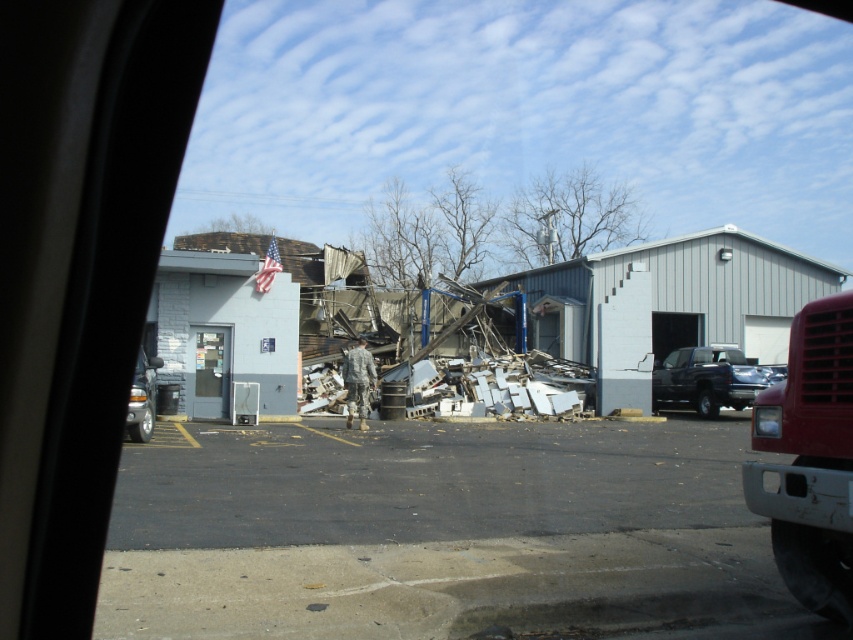
Question: Does matte black truck at right appear over clear glass vending machine at center?

Choices:
 (A) yes
 (B) no

Answer: (B)

Question: Does gray asphalt parking lot at center have a lesser width compared to matte black truck at right?

Choices:
 (A) no
 (B) yes

Answer: (A)

Question: Which of the following is the closest to the observer?

Choices:
 (A) (202, 378)
 (B) (131, 410)
 (C) (596, 579)
 (D) (738, 353)

Answer: (C)

Question: Which point is farther to the camera?

Choices:
 (A) clear glass vending machine at center
 (B) matte black truck at right
 (C) matte silver truck at left

Answer: (B)

Question: Which is farther from the clear glass vending machine at center?

Choices:
 (A) matte black truck at right
 (B) gray asphalt parking lot at center
 (C) matte silver truck at left

Answer: (A)

Question: Is the position of matte silver truck at left more distant than that of clear glass vending machine at center?

Choices:
 (A) yes
 (B) no

Answer: (B)